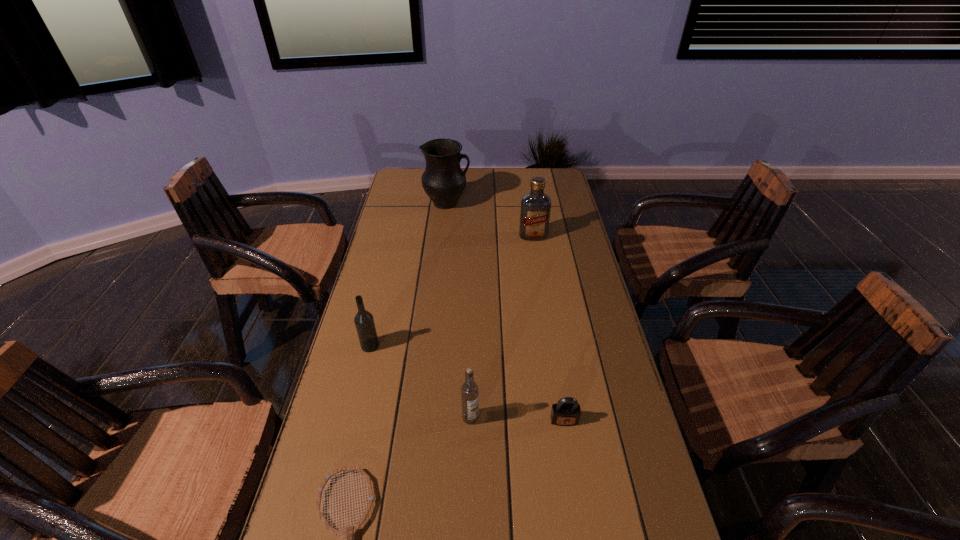
Find the location of a particular element. The height and width of the screenshot is (540, 960). blank area at the right edge is located at coordinates (590, 312).

Locate an element on the screen. The width and height of the screenshot is (960, 540). free space at the far right corner of the desktop is located at coordinates (555, 179).

The width and height of the screenshot is (960, 540). I want to click on unoccupied position between the farthest object and the farthest vodka, so click(x=490, y=220).

Locate an element on the screen. free space that is in between the second farthest object and the nearest vodka is located at coordinates (502, 327).

Where is `vacant point located between the second farthest vodka and the farthest vodka`? The height and width of the screenshot is (540, 960). vacant point located between the second farthest vodka and the farthest vodka is located at coordinates (451, 291).

Where is `empty location between the second vodka from left to right and the third farthest object`? The height and width of the screenshot is (540, 960). empty location between the second vodka from left to right and the third farthest object is located at coordinates (420, 382).

Where is `free space between the fifth tallest object and the second vodka from right to left`? Image resolution: width=960 pixels, height=540 pixels. free space between the fifth tallest object and the second vodka from right to left is located at coordinates (517, 419).

You are a GUI agent. You are given a task and a screenshot of the screen. Output one action in this format:
    pyautogui.click(x=<x>, y=<y>)
    Task: Click on the fourth closest object relative to the tennis racket
    This screenshot has height=540, width=960.
    Given the screenshot: What is the action you would take?
    pyautogui.click(x=535, y=210)

What are the coordinates of `object that ranks as the closest to the second shortest object` in the screenshot? It's located at (469, 390).

Identify the location of vodka that can be found as the second closest to the nearest vodka. (535, 210).